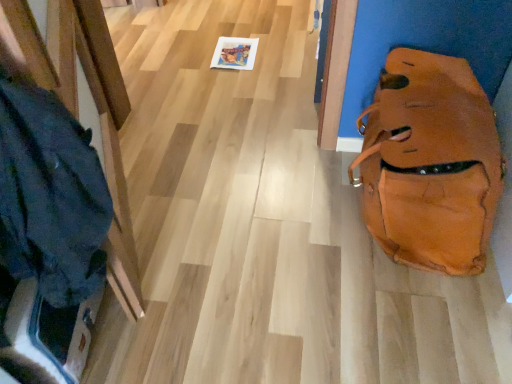
In order to face leather backpack at right, should I rotate leftwards or rightwards?

Rotate your view right by about 21.684°.

What do you see at coordinates (430, 163) in the screenshot? This screenshot has height=384, width=512. I see `leather backpack at right` at bounding box center [430, 163].

Locate an element on the screen. leather backpack at right is located at coordinates (430, 163).

This screenshot has height=384, width=512. Find the location of `leather backpack at right`. leather backpack at right is located at coordinates (430, 163).